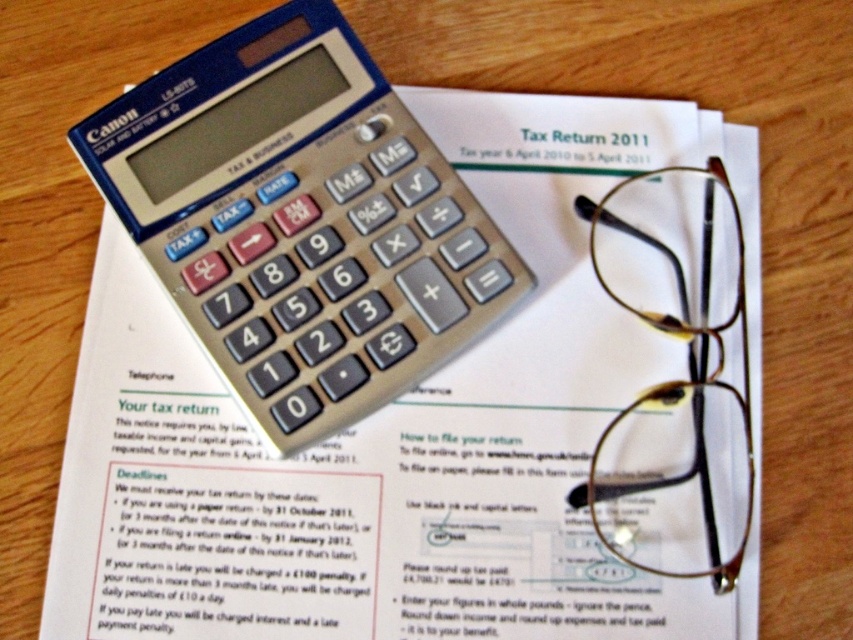
Question: Can you confirm if white paper at upper center is positioned below gold metallic glasses at upper right?

Choices:
 (A) no
 (B) yes

Answer: (B)

Question: Does silver metallic calculator at center have a lesser width compared to gold metallic glasses at upper right?

Choices:
 (A) yes
 (B) no

Answer: (B)

Question: Estimate the real-world distances between objects in this image. Which object is closer to the white paper at upper center?

Choices:
 (A) silver metallic calculator at center
 (B) gold metallic glasses at upper right

Answer: (A)

Question: Estimate the real-world distances between objects in this image. Which object is closer to the gold metallic glasses at upper right?

Choices:
 (A) white paper at upper center
 (B) silver metallic calculator at center

Answer: (A)

Question: Which object is the closest to the gold metallic glasses at upper right?

Choices:
 (A) white paper at upper center
 (B) silver metallic calculator at center

Answer: (A)

Question: From the image, what is the correct spatial relationship of white paper at upper center in relation to silver metallic calculator at center?

Choices:
 (A) right
 (B) left

Answer: (A)